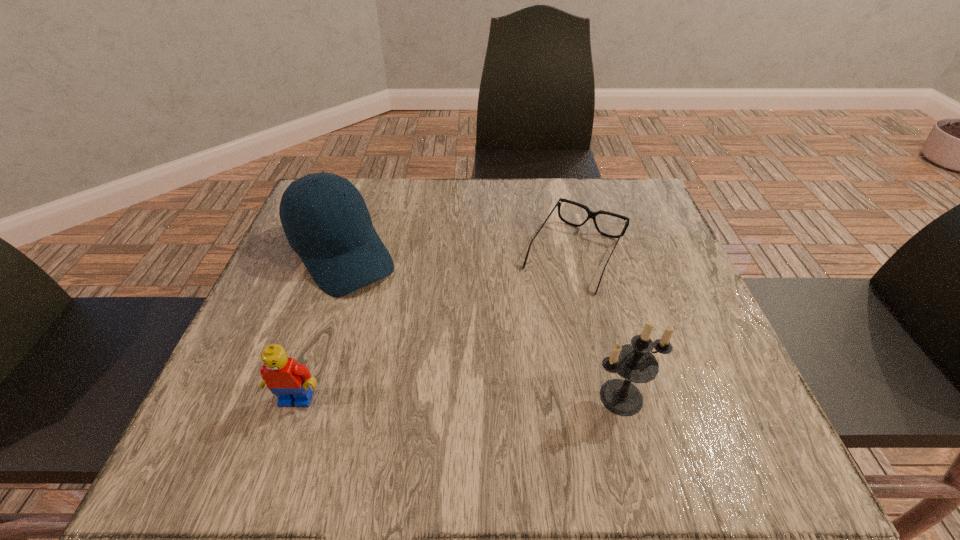
I want to click on vacant position located 0.230m on the front-facing side of the baseball cap, so click(422, 363).

Locate an element on the screen. This screenshot has height=540, width=960. spectacles that is at the far edge is located at coordinates (591, 214).

The image size is (960, 540). Find the location of `baseball cap at the far edge`. baseball cap at the far edge is located at coordinates (335, 239).

This screenshot has width=960, height=540. In order to click on Lego at the near edge in this screenshot , I will do `click(288, 380)`.

Where is `candle holder located at the near edge`? The height and width of the screenshot is (540, 960). candle holder located at the near edge is located at coordinates (635, 362).

At what (x,y) coordinates should I click in order to perform the action: click on Lego at the left edge. Please return your answer as a coordinate pair (x, y). The image size is (960, 540). Looking at the image, I should click on (288, 380).

The width and height of the screenshot is (960, 540). Identify the location of baseball cap that is at the left edge. (335, 239).

Find the location of a particular element. Image resolution: width=960 pixels, height=540 pixels. candle holder located in the right edge section of the desktop is located at coordinates (635, 362).

Image resolution: width=960 pixels, height=540 pixels. I want to click on spectacles at the right edge, so click(591, 214).

Find the location of a particular element. This screenshot has width=960, height=540. object that is at the far left corner is located at coordinates (335, 239).